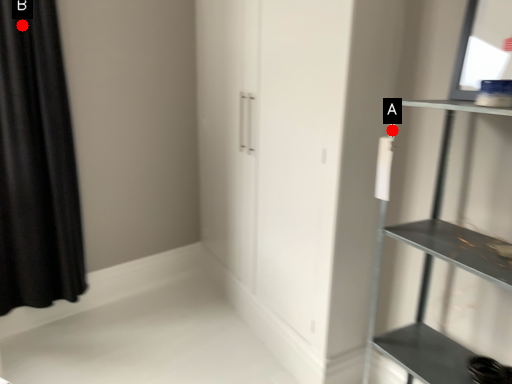
Question: Two points are circled on the image, labeled by A and B beside each circle. Among these points, which one is farthest from the camera?

Choices:
 (A) A is further
 (B) B is further

Answer: (B)